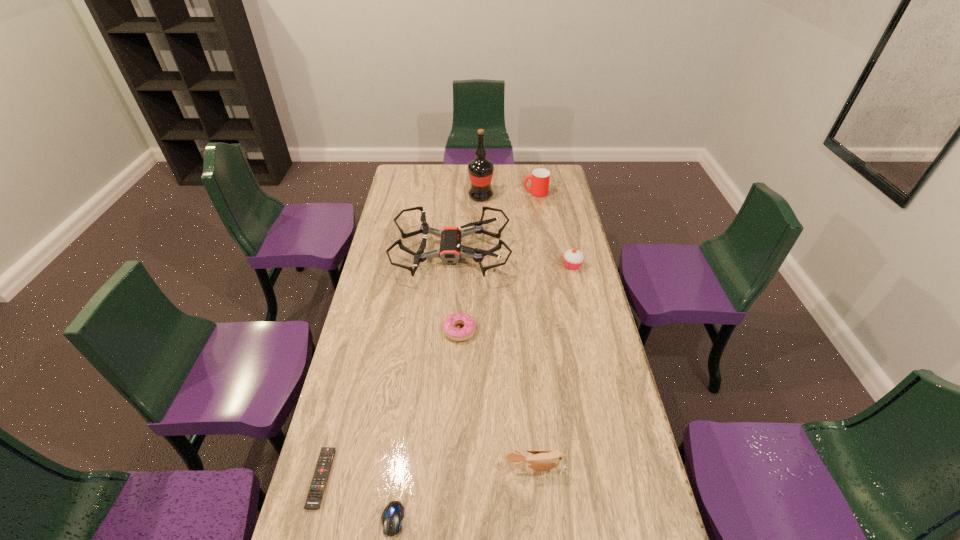
Identify the location of empty space that is in between the cupcake and the cup. The height and width of the screenshot is (540, 960). (554, 230).

This screenshot has width=960, height=540. Find the location of `free spot between the cup and the cupcake`. free spot between the cup and the cupcake is located at coordinates (554, 230).

The height and width of the screenshot is (540, 960). Find the location of `empty space that is in between the cup and the sixth tallest object`. empty space that is in between the cup and the sixth tallest object is located at coordinates (497, 262).

Where is `vacant region between the bird and the third shortest object`? This screenshot has width=960, height=540. vacant region between the bird and the third shortest object is located at coordinates (498, 400).

Where is `free space between the cupcake and the second shortest object`? free space between the cupcake and the second shortest object is located at coordinates (483, 392).

I want to click on vacant space that's between the shortest object and the cupcake, so click(446, 372).

The image size is (960, 540). What are the coordinates of `vacant area between the cup and the remote control` in the screenshot? It's located at (428, 335).

Where is `vacant space that's between the seventh tallest object and the cupcake`? The image size is (960, 540). vacant space that's between the seventh tallest object and the cupcake is located at coordinates (483, 392).

Point out which object is positioned as the third nearest to the cupcake. Please provide its 2D coordinates. Your answer should be formatted as a tuple, i.e. [(x, y)], where the tuple contains the x and y coordinates of a point satisfying the conditions above.

[(540, 178)]

Find the location of a particular element. This screenshot has height=540, width=960. object that is the second closest to the bird is located at coordinates pos(456,334).